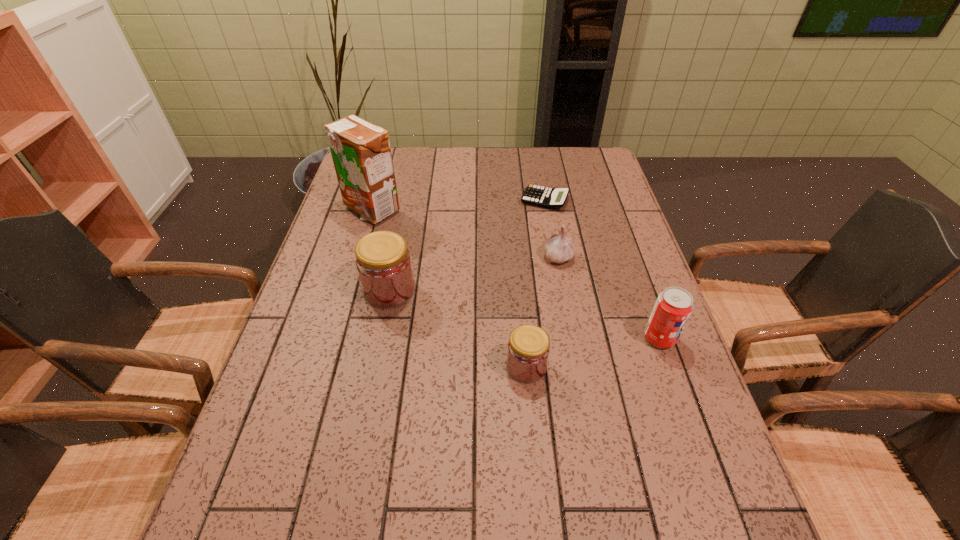
At what (x,y) coordinates should I click in order to perform the action: click on blank space located 0.240m on the back of the third farthest object. Please return your answer as a coordinate pair (x, y). This screenshot has height=540, width=960. Looking at the image, I should click on (547, 197).

The width and height of the screenshot is (960, 540). In order to click on vacant space located 0.250m on the left of the shortest object in this screenshot , I will do `click(443, 200)`.

This screenshot has width=960, height=540. I want to click on vacant space located on the straw side of the tallest object, so click(x=348, y=290).

The image size is (960, 540). In order to click on blank space located on the left of the rightmost object in this screenshot , I will do `click(503, 338)`.

Locate an element on the screen. jam at the left edge is located at coordinates tap(383, 262).

Where is `carton located at the left edge`? The width and height of the screenshot is (960, 540). carton located at the left edge is located at coordinates (361, 153).

Find the location of `object present at the right edge`. object present at the right edge is located at coordinates (673, 307).

The width and height of the screenshot is (960, 540). Identify the location of free space at the far edge of the desktop. (419, 163).

Locate an element on the screen. This screenshot has width=960, height=540. free space at the near edge is located at coordinates (520, 480).

The image size is (960, 540). I want to click on free location at the left edge, so [x=364, y=224].